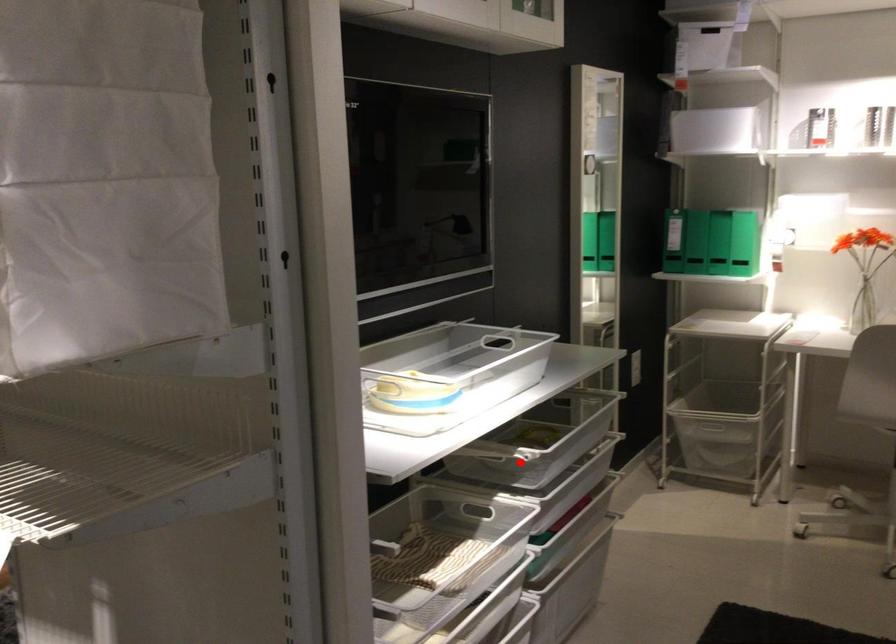
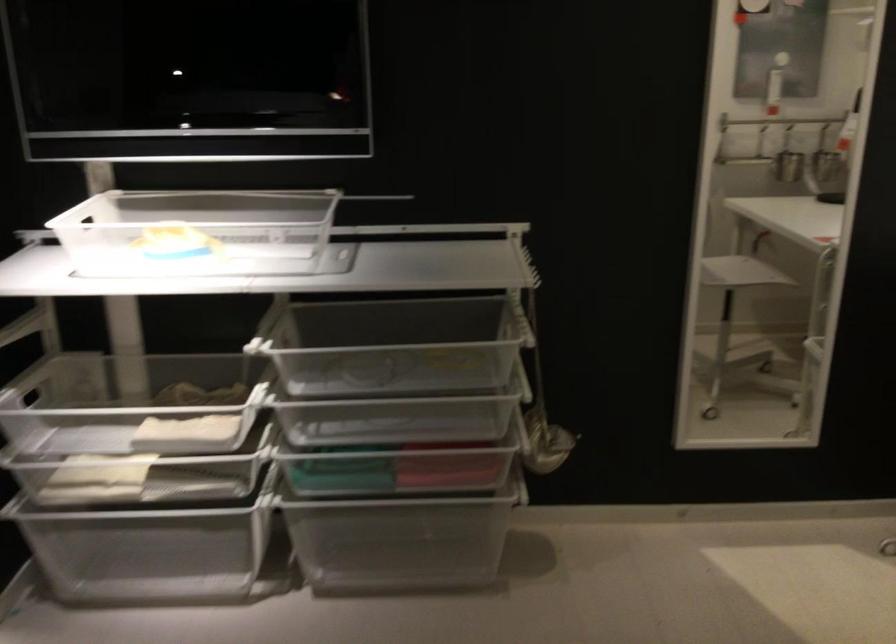
Question: I am providing you with two images of the same scene from different viewpoints. Given a red point in image1, look at the same physical point in image2. Is it:

Choices:
 (A) Closer to the viewpoint
 (B) Farther from the viewpoint

Answer: (A)